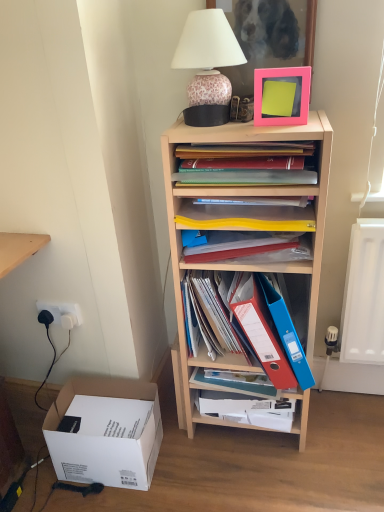
You are a GUI agent. You are given a task and a screenshot of the screen. Output one action in this format:
    pyautogui.click(x=<x>, y=<y>)
    Task: Click on the vacant space situated on the left part of pink matte picture frame at upper center, acting as the 1th picture frame starting from the bottom
    The width and height of the screenshot is (384, 512).
    Given the screenshot: What is the action you would take?
    pyautogui.click(x=230, y=128)